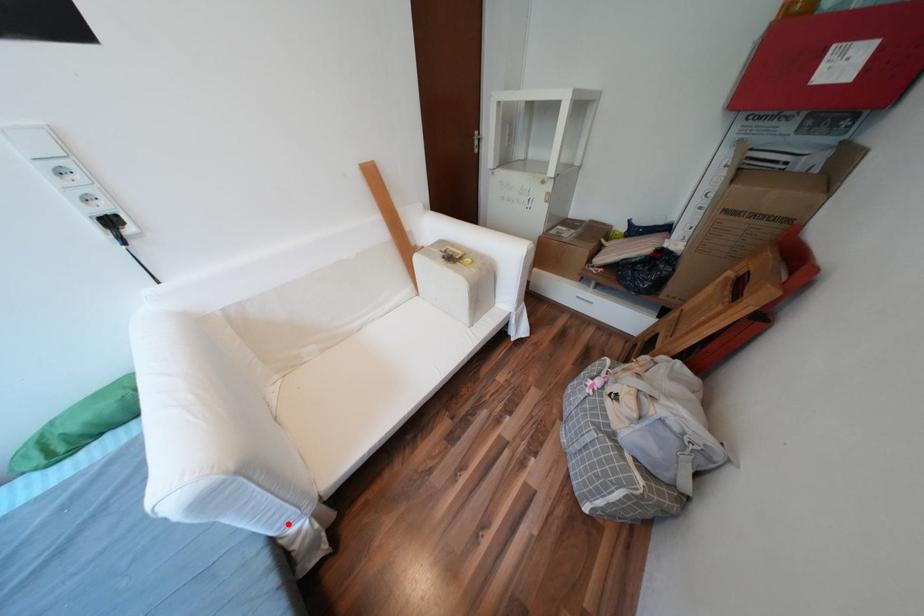
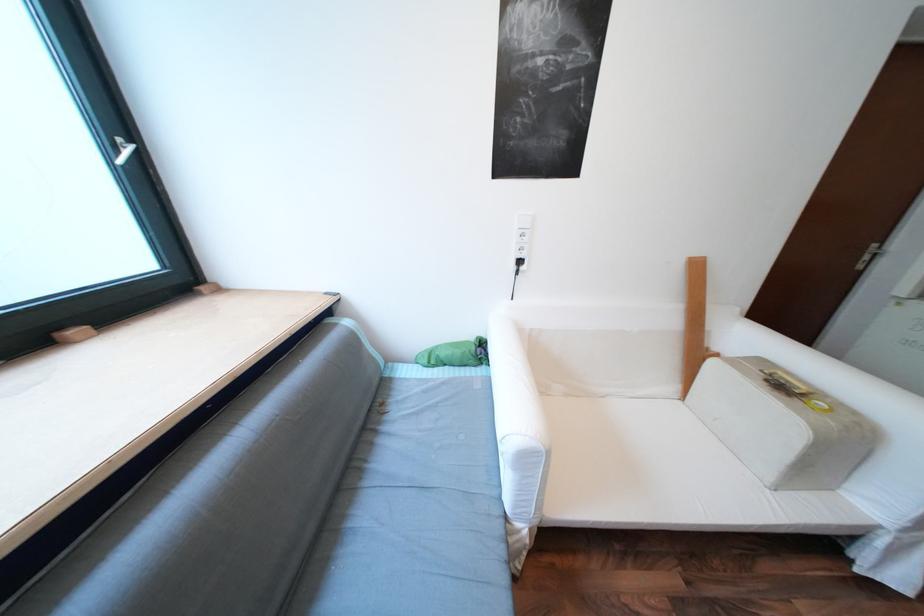
Locate, in the second image, the point that corresponds to the highlighted location in the first image.

(528, 511)